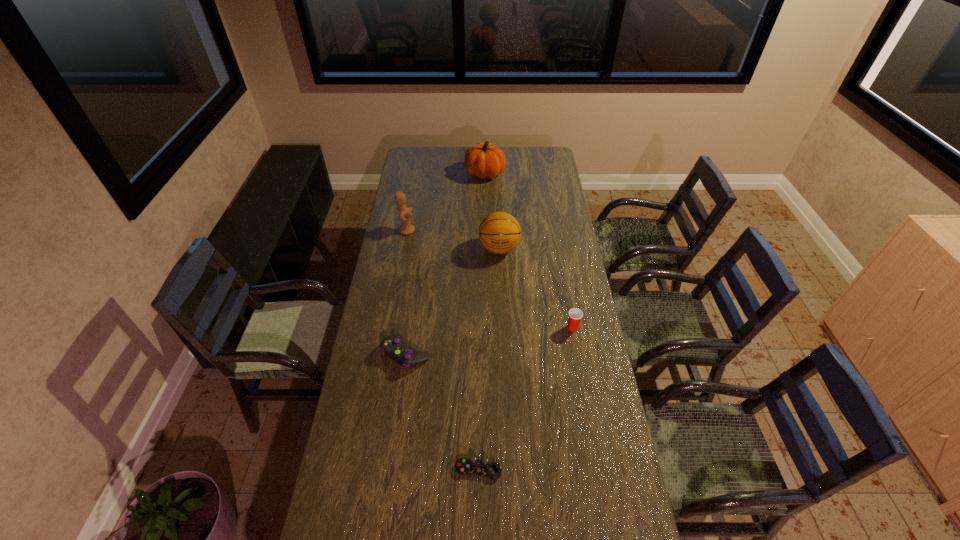
You are a GUI agent. You are given a task and a screenshot of the screen. Output one action in this format:
    pyautogui.click(x=<x>, y=<y>)
    Task: Click on the free space at the left edge
    This screenshot has width=960, height=540.
    Given the screenshot: What is the action you would take?
    pyautogui.click(x=381, y=289)

Find the location of a particular element. free location at the right edge is located at coordinates (544, 259).

Identify the location of vacant space at the far left corner of the desktop. (409, 154).

Image resolution: width=960 pixels, height=540 pixels. What are the coordinates of `empty space between the figurine and the shortest object` in the screenshot? It's located at (443, 350).

I want to click on vacant space that's between the basketball and the fourth farthest object, so click(x=536, y=288).

The image size is (960, 540). What are the coordinates of `vacant area between the pumpkin and the shortest object` in the screenshot? It's located at (482, 321).

Locate an element on the screen. empty location between the basketball and the farthest object is located at coordinates (492, 211).

This screenshot has height=540, width=960. What are the coordinates of `empty space between the basketball and the fifth farthest object` in the screenshot? It's located at (452, 301).

The width and height of the screenshot is (960, 540). Identify the location of free space that is in between the shorter control and the basketball. (489, 359).

Image resolution: width=960 pixels, height=540 pixels. I want to click on free space between the basketball and the nearer control, so click(489, 359).